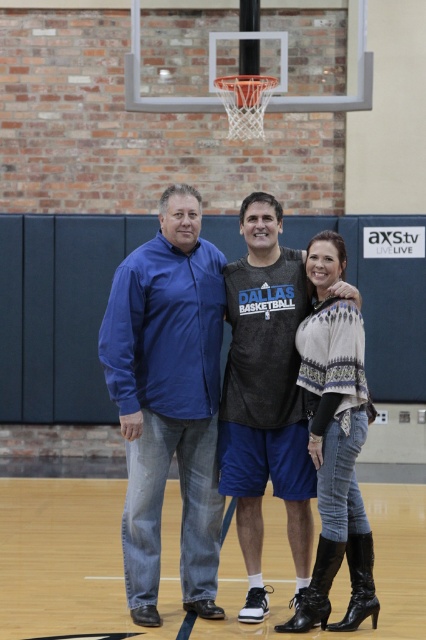
Question: Can you confirm if matte black jersey at center is thinner than dark gray jersey at center?

Choices:
 (A) no
 (B) yes

Answer: (A)

Question: Is matte black jersey at center in front of knit sweater at center?

Choices:
 (A) yes
 (B) no

Answer: (B)

Question: Is matte black jersey at center below dark gray jersey at center?

Choices:
 (A) no
 (B) yes

Answer: (A)

Question: Among these points, which one is nearest to the camera?

Choices:
 (A) (192, 285)
 (B) (342, 529)

Answer: (B)

Question: Which object is the farthest from the blue denim jeans at left?

Choices:
 (A) knit sweater at center
 (B) matte black jersey at center
 (C) dark gray jersey at center

Answer: (A)

Question: Based on their relative distances, which object is nearer to the blue denim jeans at left?

Choices:
 (A) dark gray jersey at center
 (B) matte black jersey at center

Answer: (B)